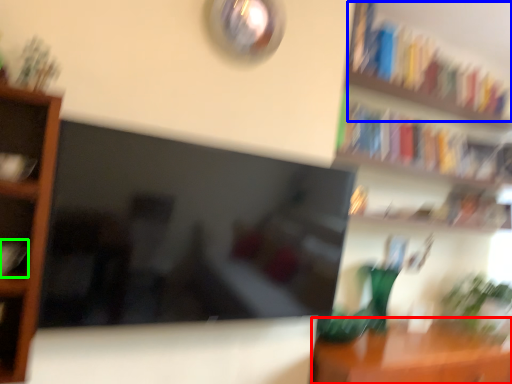
Question: Considering the real-world distances, which object is farthest from table (highlighted by a red box)? book (highlighted by a blue box) or book (highlighted by a green box)?

Choices:
 (A) book
 (B) book

Answer: (B)